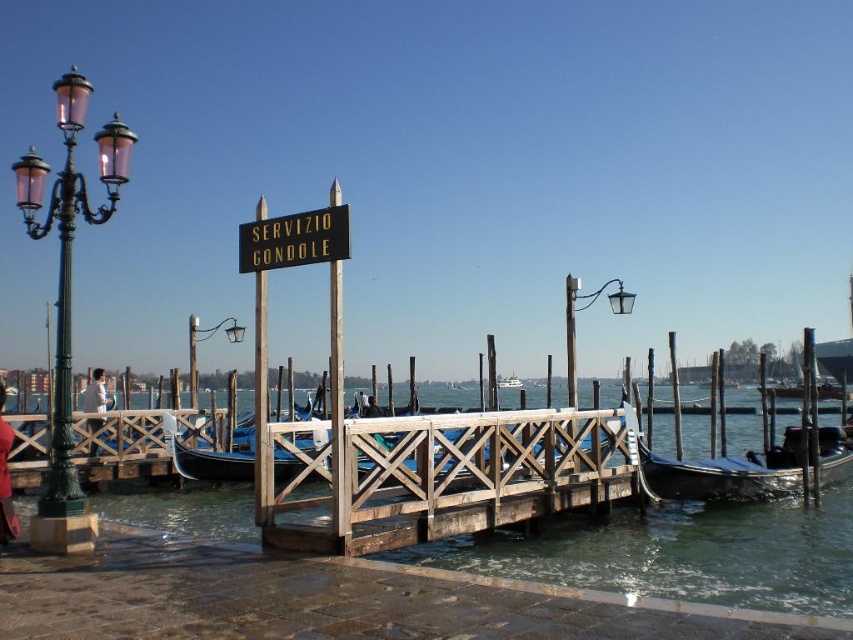
Question: Which point appears closest to the camera in this image?

Choices:
 (A) (257, 412)
 (B) (61, 445)
 (C) (231, 502)

Answer: (A)

Question: Among these objects, which one is nearest to the camera?

Choices:
 (A) shiny silver gondola at lower right
 (B) wooden dock at center

Answer: (B)

Question: Can you confirm if matte black lamp post at upper right is positioned to the right of matte black lamp post at upper center?

Choices:
 (A) no
 (B) yes

Answer: (B)

Question: Which of these objects is positioned farthest from the matte black lamp post at upper right?

Choices:
 (A) matte black lamp post at upper center
 (B) blue polished wood gondola at center

Answer: (A)

Question: Is clear water at dock center positioned in front of white glossy boat at center?

Choices:
 (A) no
 (B) yes

Answer: (B)

Question: Considering the relative positions of green glass streetlamp at left and shiny silver gondola at lower right in the image provided, where is green glass streetlamp at left located with respect to shiny silver gondola at lower right?

Choices:
 (A) left
 (B) right

Answer: (A)